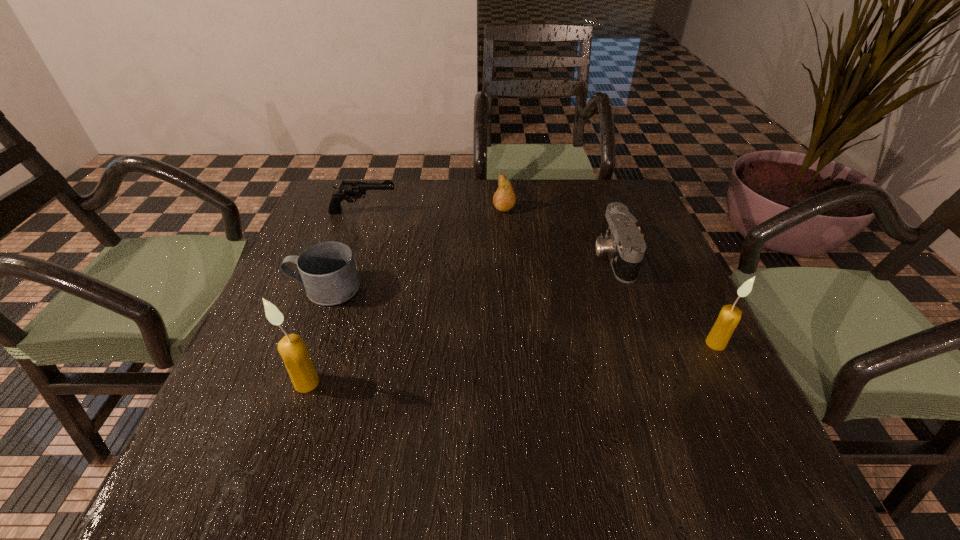
This screenshot has height=540, width=960. What are the coordinates of `vacant space that is in between the third object from right to left and the mug` in the screenshot? It's located at (x=415, y=248).

Identify the location of vacant area that lies between the fourth object from left to right and the nearer candle. (405, 295).

Locate an element on the screen. This screenshot has height=540, width=960. vacant area between the third object from right to left and the mug is located at coordinates (415, 248).

Identify the location of free spot between the camera and the mug. This screenshot has width=960, height=540. (469, 272).

What are the coordinates of `free space between the shorter candle and the nearest object` in the screenshot? It's located at (511, 363).

I want to click on unoccupied area between the farther candle and the mug, so click(520, 316).

The image size is (960, 540). Identify the location of vacant area that lies between the mug and the camera. (469, 272).

Select which object is the closest to the mug. Please provide its 2D coordinates. Your answer should be formatted as a tuple, i.e. [(x, y)], where the tuple contains the x and y coordinates of a point satisfying the conditions above.

[(292, 348)]

Choose which object is the third nearest neighbor to the fifth object from left to right. Please provide its 2D coordinates. Your answer should be formatted as a tuple, i.e. [(x, y)], where the tuple contains the x and y coordinates of a point satisfying the conditions above.

[(348, 190)]

Locate an element on the screen. The width and height of the screenshot is (960, 540). free spot that satisfies the following two spatial constraints: 1. on the lens of the camera; 2. on the back side of the shorter candle is located at coordinates (644, 343).